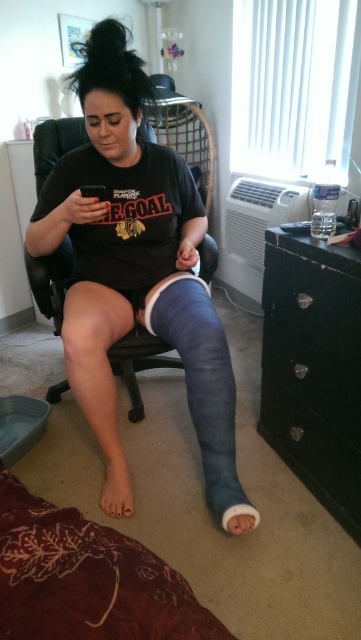
Measure the distance between black glossy dresser at lower right and camera.

black glossy dresser at lower right and camera are 1.18 meters apart.

Describe the element at coordinates (314, 369) in the screenshot. The height and width of the screenshot is (640, 361). I see `black glossy dresser at lower right` at that location.

Who is more forward, (283, 289) or (123, 472)?

Point (283, 289) is more forward.

Identify the location of black glossy dresser at lower right. This screenshot has width=361, height=640. (314, 369).

Which is more to the left, smooth white cast at lower left or white matte cast at lower center?

Positioned to the left is smooth white cast at lower left.

Who is lower down, smooth white cast at lower left or white matte cast at lower center?

Positioned lower is white matte cast at lower center.

Which is behind, point (103, 504) or point (228, 522)?

Point (103, 504)

Find the location of a particular element. smooth white cast at lower left is located at coordinates (116, 490).

Is blue cast at lower left closer to the viewer compared to black glossy dresser at lower right?

No, blue cast at lower left is further to the viewer.

Locate an element on the screen. Image resolution: width=361 pixels, height=640 pixels. blue cast at lower left is located at coordinates (135, 259).

Between point (167, 180) and point (299, 259), which one is positioned behind?

Point (167, 180)

This screenshot has height=640, width=361. In order to click on blue cast at lower left in this screenshot , I will do `click(135, 259)`.